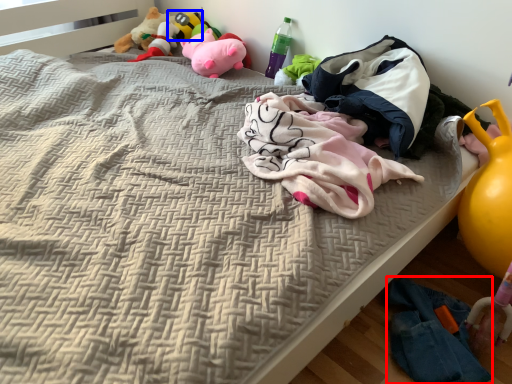
Question: Which point is closer to the camera, clothing (highlighted by a red box) or toy (highlighted by a blue box)?

Choices:
 (A) clothing
 (B) toy

Answer: (A)